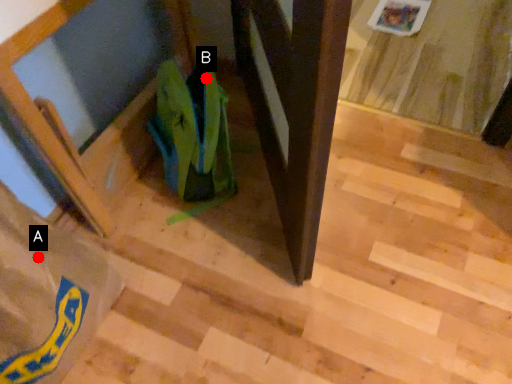
Question: Two points are circled on the image, labeled by A and B beside each circle. Which point appears closest to the camera in this image?

Choices:
 (A) A is closer
 (B) B is closer

Answer: (A)